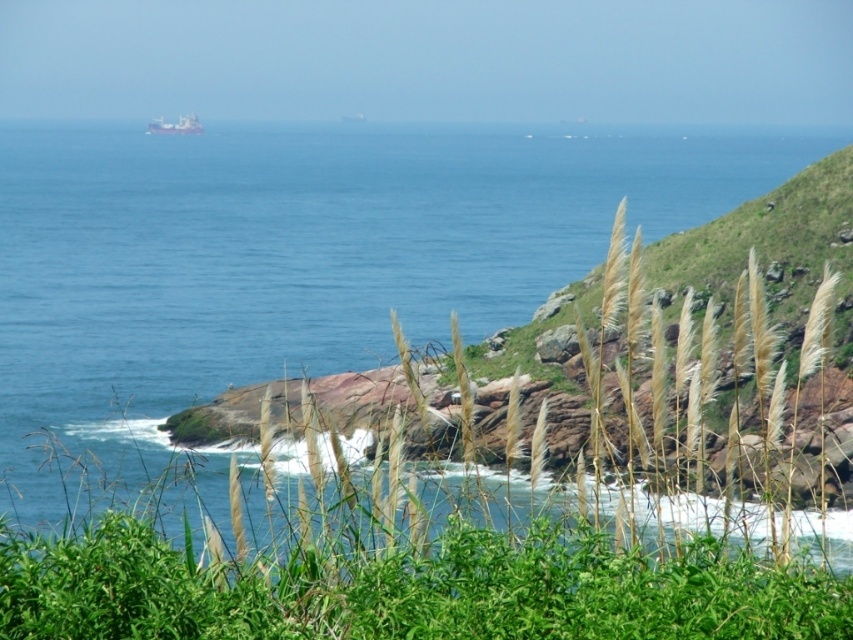
You are standing at the point with coordinates point (161, 118) and want to walk towards the ocean. Is the point point (508, 316) blocking your path?

Point (508, 316) is in front of point (161, 118), so yes, the point point (508, 316) is blocking your path.

You are standing at the point marked as point [297,259] in the coastal scene. What is the immediate environment around you like?

The point [297,259] corresponds to blue water at center, so you are surrounded by the vast deep blue ocean.

You are standing at the edge of the cliff overlooking the ocean. You see the blue water at center and the metallic gray ship at upper center. Which object is positioned to the right of the other?

The blue water at center is to the right of the metallic gray ship at upper center.